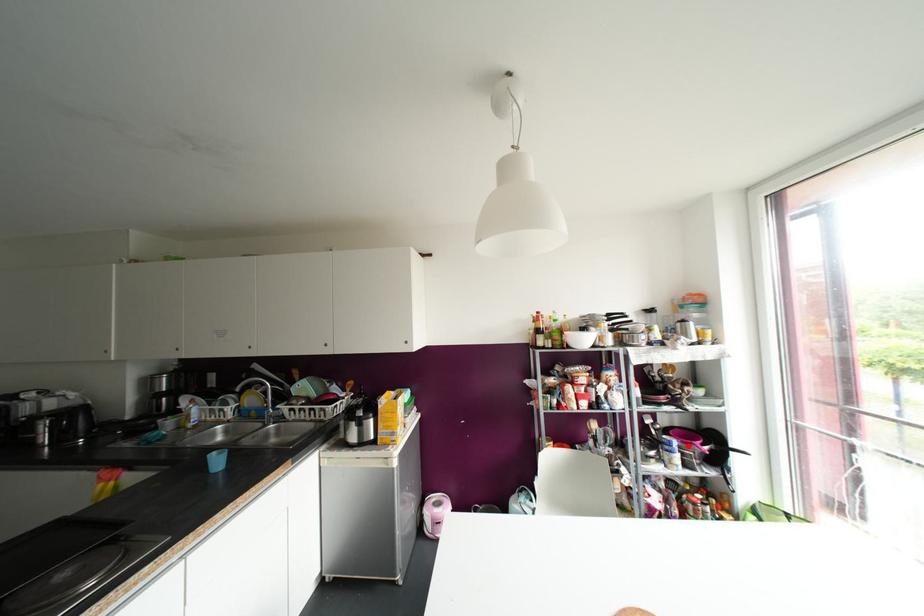
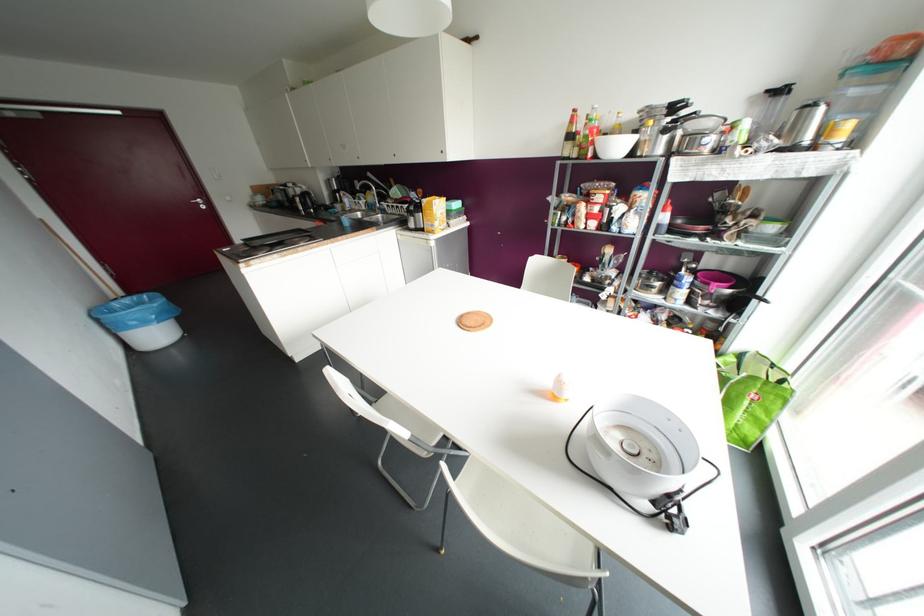
Question: I am providing you with two images of the same scene from different viewpoints. In image1, a red point is highlighted. Considering the same 3D point in image2, which of the following is correct?

Choices:
 (A) It is closer
 (B) It is farther

Answer: (A)